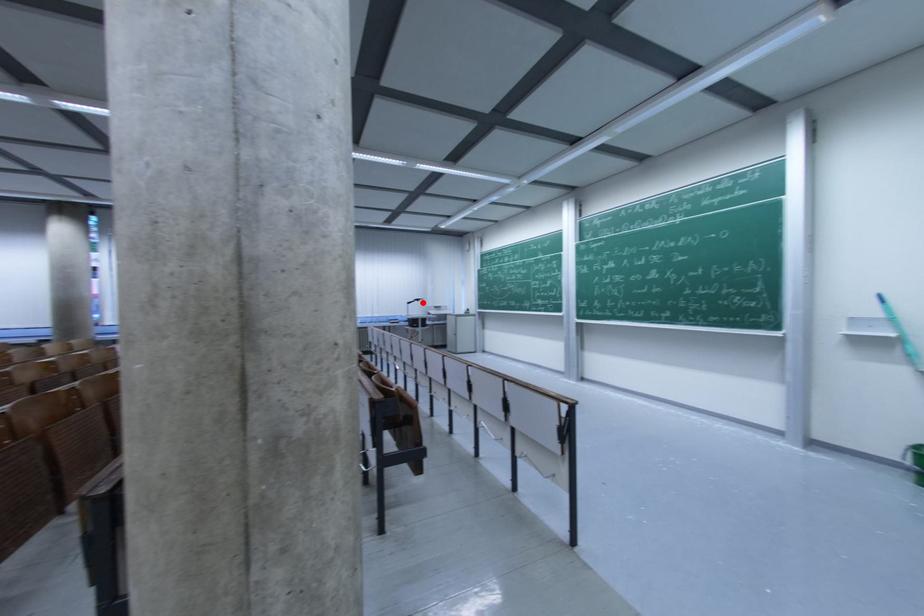
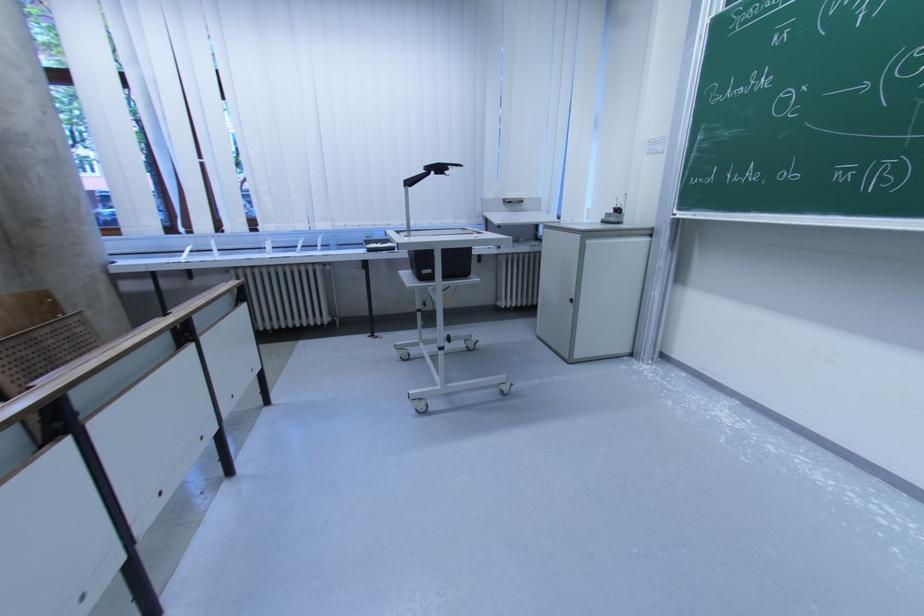
Find the pixel in the second image that matches the highlighted location in the first image.

(444, 171)